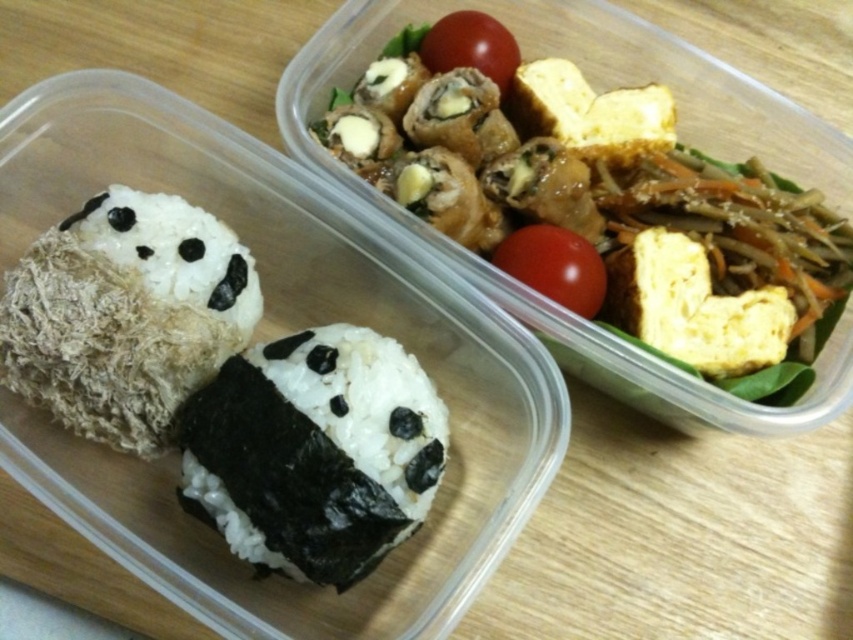
You are a food delivery person who needs to stack the smooth tofu at upper center and the red matte tomato at upper center into a single compartment. Which one should you place at the bottom to prevent the top item from crushing the bottom one?

The smooth tofu at upper center is much taller than the red matte tomato at upper center. Since tofu is softer and more prone to crushing, it should be placed on top of the red matte tomato at upper center to prevent it from being crushed.

From the picture: You are a food delivery person who needs to place a protective layer between the smooth tofu at upper center and the red matte tomato at center to prevent the tomato from crushing the tofu. Based on their positions, where should you place the protective layer?

The smooth tofu at upper center is above the red matte tomato at center, so you should place the protective layer between the smooth tofu at upper center and the red matte tomato at center to prevent the tomato from crushing the tofu.

In the scene shown: You are a food delivery person who needs to hand over the containers to the customer. You want to ensure that the smooth tofu at upper center and the red matte tomato at center are visible to the customer. Which container should you hold closer to the customer?

The smooth tofu at upper center is closer to the viewer than the red matte tomato at center, so you should hold the container with the smooth tofu at upper center closer to the customer to ensure both items are visible.